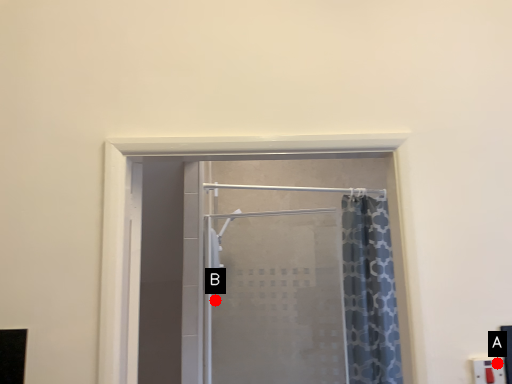
Question: Two points are circled on the image, labeled by A and B beside each circle. Which point appears farthest from the camera in this image?

Choices:
 (A) A is further
 (B) B is further

Answer: (B)